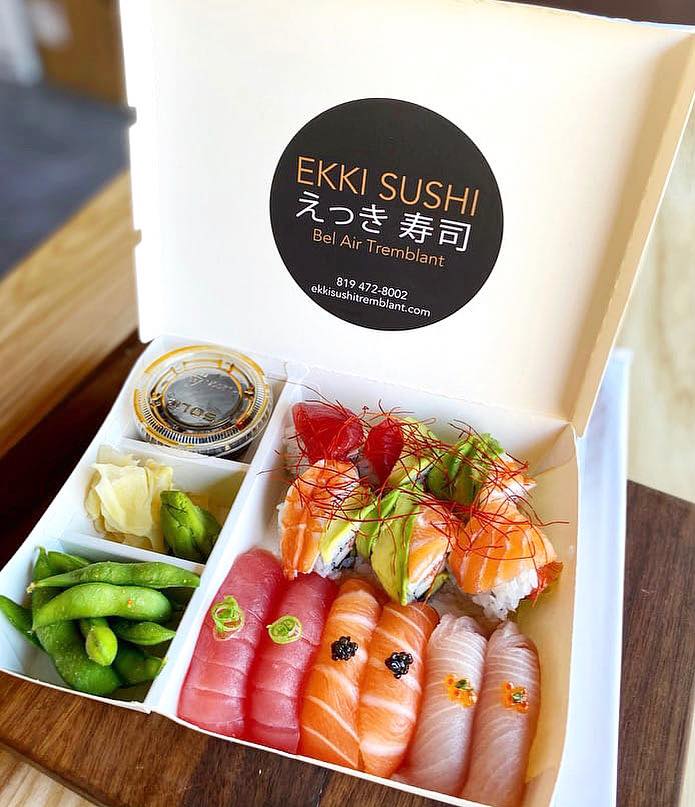
The height and width of the screenshot is (807, 695). What are the coordinates of `floor` in the screenshot? It's located at (49, 162).